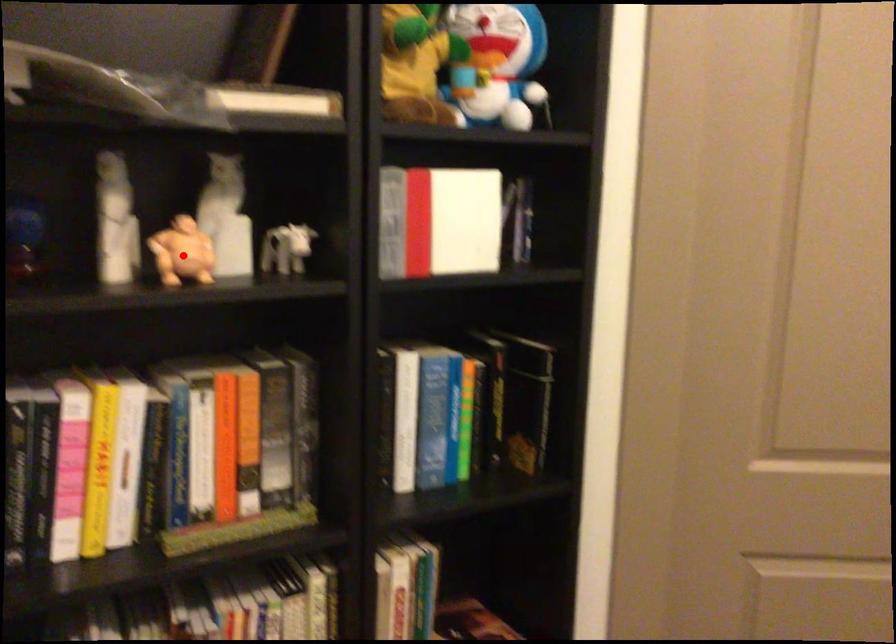
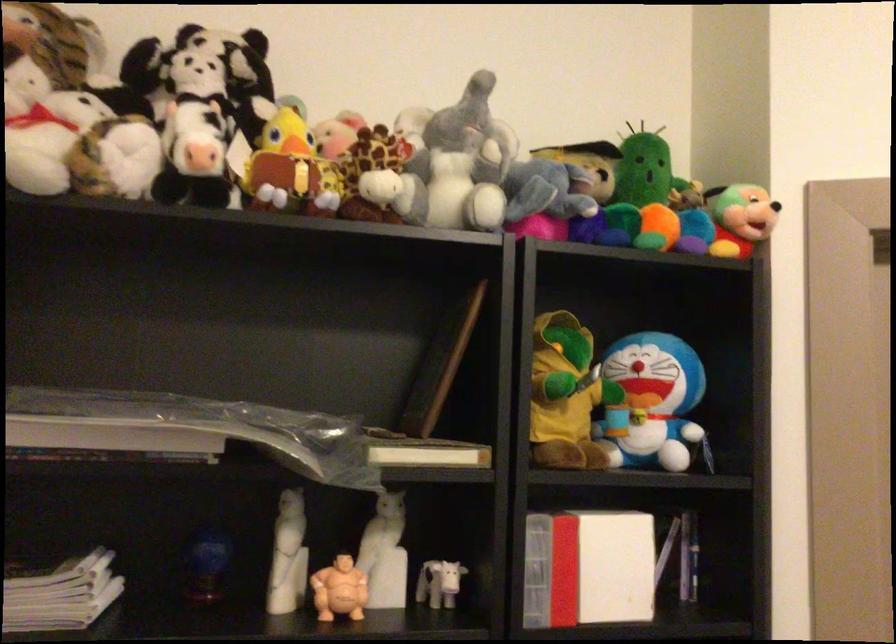
Find the pixel in the second image that matches the highlighted location in the first image.

(339, 589)